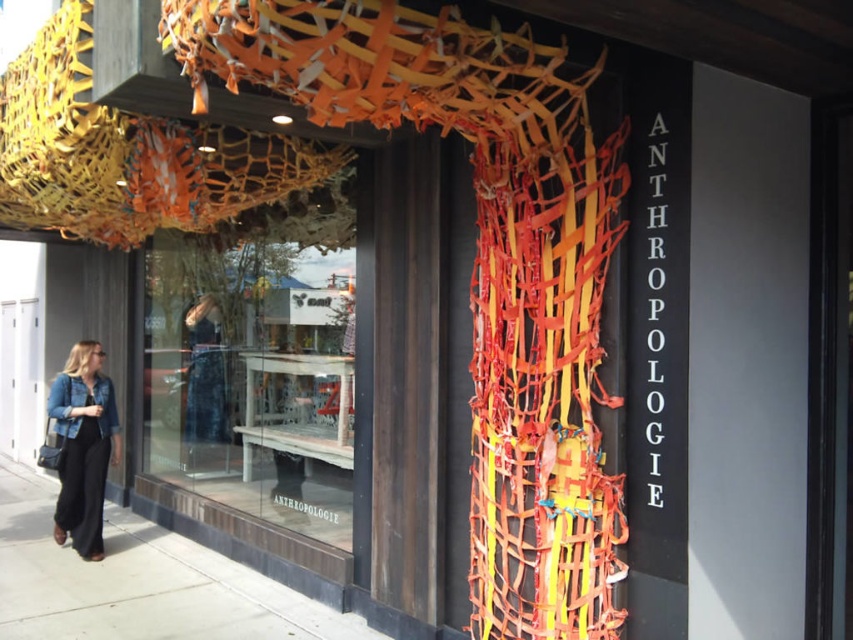
Question: Does transparent glass display at center appear on the left side of denim jacket at lower left?

Choices:
 (A) no
 (B) yes

Answer: (A)

Question: Among these objects, which one is farthest from the camera?

Choices:
 (A) transparent glass display at center
 (B) smooth concrete sidewalk at lower left
 (C) denim jacket at lower left

Answer: (C)

Question: Which object appears farthest from the camera in this image?

Choices:
 (A) denim jacket at lower left
 (B) smooth concrete sidewalk at lower left

Answer: (A)

Question: Is smooth concrete sidewalk at lower left thinner than denim jacket at lower left?

Choices:
 (A) no
 (B) yes

Answer: (A)

Question: Among these points, which one is farthest from the camera?

Choices:
 (A) (172, 550)
 (B) (73, 493)
 (C) (189, 332)

Answer: (C)

Question: Is transparent glass display at center thinner than denim jacket at lower left?

Choices:
 (A) no
 (B) yes

Answer: (A)